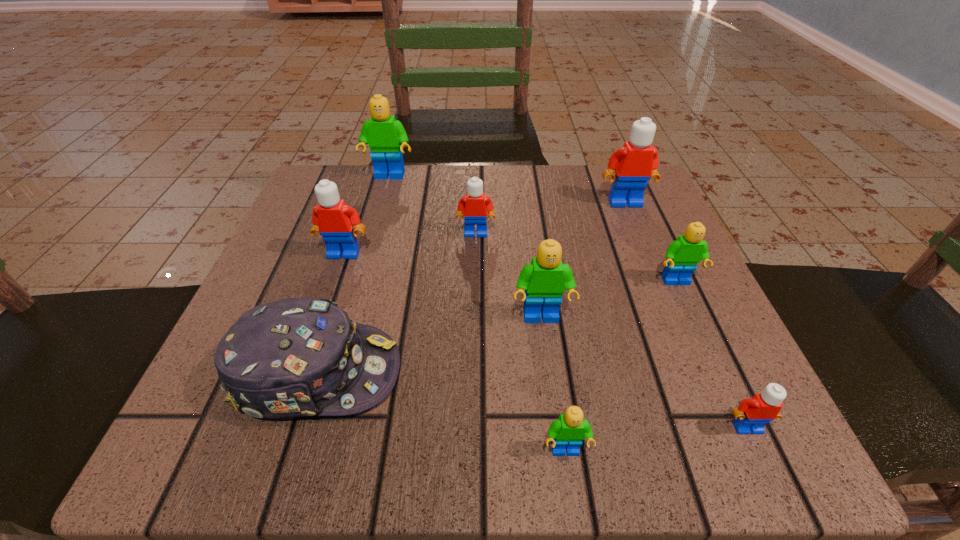
Find the location of a particular element. The width and height of the screenshot is (960, 540). the rightmost green Lego is located at coordinates (682, 255).

What are the coordinates of `the fifth nearest object` in the screenshot? It's located at (682, 255).

Where is `headwear`? This screenshot has width=960, height=540. headwear is located at coordinates (299, 357).

Where is `the seventh farthest Lego`? Image resolution: width=960 pixels, height=540 pixels. the seventh farthest Lego is located at coordinates (752, 415).

What are the coordinates of `the nearest white Lego` in the screenshot? It's located at (752, 415).

Find the location of a particular element. the smallest green Lego is located at coordinates (570, 429).

You are a GUI agent. You are given a task and a screenshot of the screen. Output one action in this format:
    pyautogui.click(x=<x>, y=<y>)
    Task: Click on the nearest Lego
    
    Given the screenshot: What is the action you would take?
    pyautogui.click(x=570, y=429)

Find the location of a particular element. The image size is (960, 540). vacant area situated on the face of the biggest white Lego is located at coordinates (690, 362).

I want to click on vacant region located on the face of the biggest green Lego, so click(x=372, y=238).

You are a GUI agent. You are given a task and a screenshot of the screen. Output one action in this format:
    pyautogui.click(x=<x>, y=<y>)
    Task: Click on the vacant area situated on the face of the leftmost white Lego
    
    Given the screenshot: What is the action you would take?
    pyautogui.click(x=318, y=329)